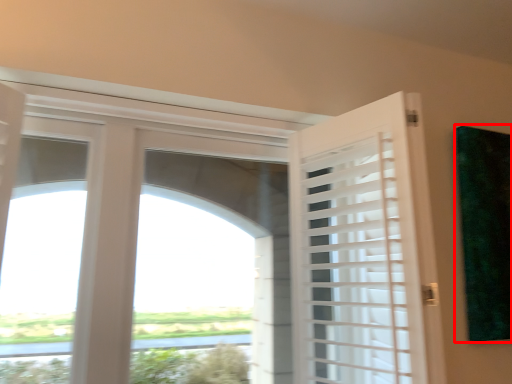
Question: Considering the relative positions of window screen (annotated by the red box) and door in the image provided, where is window screen (annotated by the red box) located with respect to the staircase?

Choices:
 (A) right
 (B) left

Answer: (A)